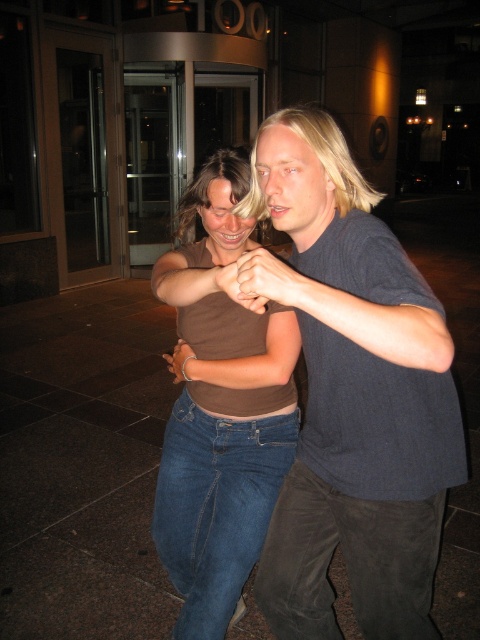
Is brown cotton shirt at center to the right of matte brown hand at center from the viewer's perspective?

Correct, you'll find brown cotton shirt at center to the right of matte brown hand at center.

Is brown cotton shirt at center positioned in front of matte brown hand at center?

Yes, it is.

What do you see at coordinates (355, 397) in the screenshot? The height and width of the screenshot is (640, 480). I see `brown cotton shirt at center` at bounding box center [355, 397].

Find the location of a particular element. Image resolution: width=480 pixels, height=640 pixels. brown cotton shirt at center is located at coordinates (355, 397).

Measure the distance between brown cotton shirt at center and camera.

brown cotton shirt at center is 93.60 centimeters from camera.

Between brown cotton shirt at center and matte brown wristband at center, which one is positioned higher?

matte brown wristband at center

Who is more distant from viewer, [348,184] or [282,368]?

The point [282,368] is behind.

Find the location of a particular element. brown cotton shirt at center is located at coordinates tap(355, 397).

Does blue denim jeans at center have a smaller size compared to matte brown wristband at center?

Incorrect, blue denim jeans at center is not smaller in size than matte brown wristband at center.

Which is behind, point (257, 538) or point (165, 353)?

The point (165, 353) is behind.

The image size is (480, 640). In order to click on blue denim jeans at center in this screenshot , I will do `click(216, 506)`.

What are the coordinates of `blue denim jeans at center` in the screenshot? It's located at (216, 506).